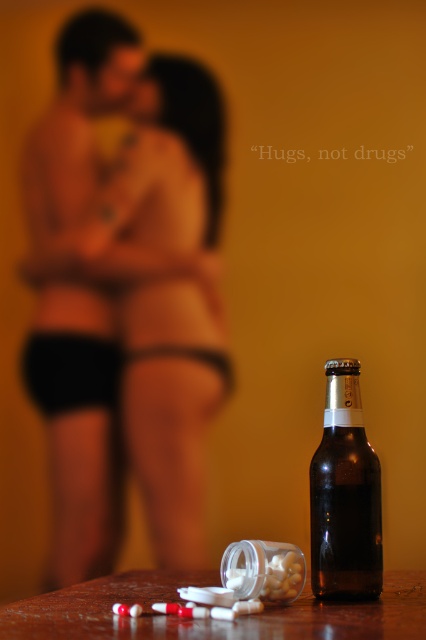
Question: Can you confirm if matte black man at center is positioned below brown glass bottle at lower right?

Choices:
 (A) no
 (B) yes

Answer: (A)

Question: Is matte black man at center positioned behind wooden table at lower center?

Choices:
 (A) yes
 (B) no

Answer: (A)

Question: Which object is farther from the camera taking this photo?

Choices:
 (A) matte black man at center
 (B) brown glass bottle at lower right

Answer: (A)

Question: Does wooden table at lower center appear over brown glass bottle at lower right?

Choices:
 (A) no
 (B) yes

Answer: (A)

Question: Which object is farther from the camera taking this photo?

Choices:
 (A) matte black man at center
 (B) brown glass bottle at lower right
 (C) wooden table at lower center

Answer: (A)

Question: Which object appears farthest from the camera in this image?

Choices:
 (A) brown glass bottle at lower right
 (B) wooden table at lower center

Answer: (A)